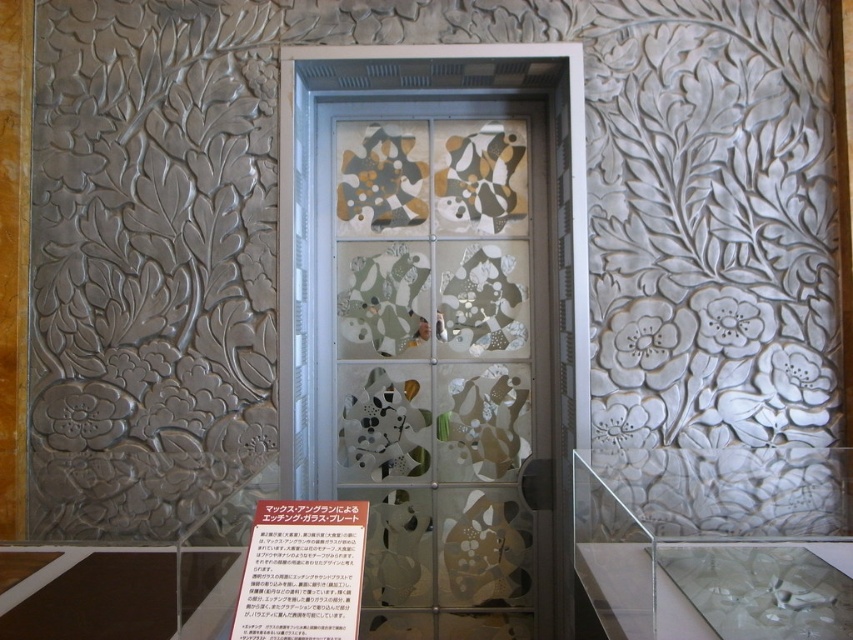
Question: Is etched glass door at center to the left of white paper at center from the viewer's perspective?

Choices:
 (A) yes
 (B) no

Answer: (B)

Question: Which point appears farthest from the camera in this image?

Choices:
 (A) (500, 196)
 (B) (316, 540)

Answer: (A)

Question: Considering the relative positions of etched glass door at center and white paper at center in the image provided, where is etched glass door at center located with respect to white paper at center?

Choices:
 (A) left
 (B) right

Answer: (B)

Question: Does etched glass door at center have a smaller size compared to white paper at center?

Choices:
 (A) no
 (B) yes

Answer: (A)

Question: Among these points, which one is farthest from the camera?

Choices:
 (A) (337, 280)
 (B) (248, 621)

Answer: (A)